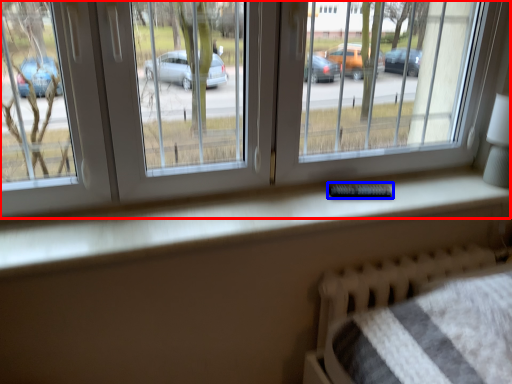
Question: Which of the following is the farthest to the observer, window (highlighted by a red box) or remote (highlighted by a blue box)?

Choices:
 (A) window
 (B) remote

Answer: (B)